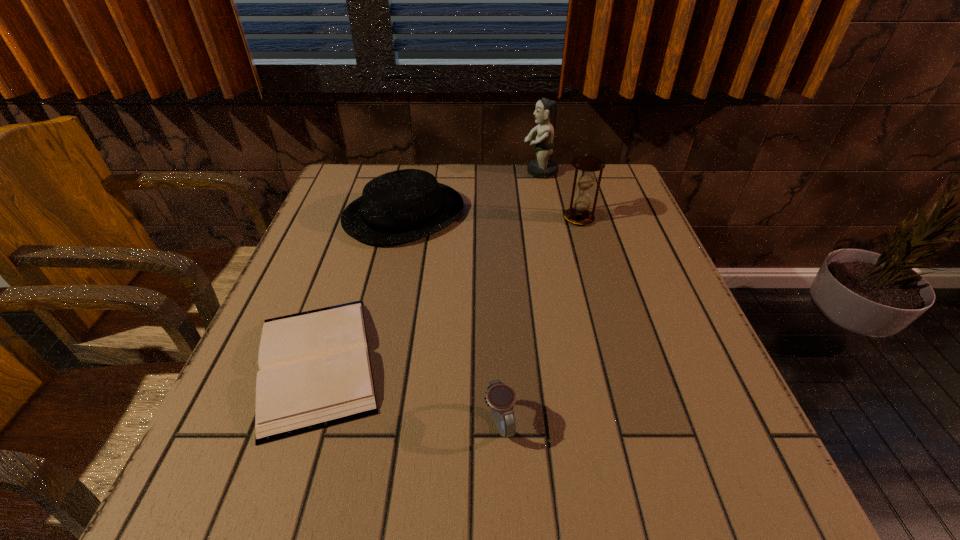
At what (x,y) coordinates should I click in order to perform the action: click on blank space located on the back of the second tallest object. Please return your answer as a coordinate pair (x, y). Looking at the image, I should click on (572, 195).

This screenshot has width=960, height=540. I want to click on free location located 0.340m on the right of the third shortest object, so click(595, 214).

You are a GUI agent. You are given a task and a screenshot of the screen. Output one action in this format:
    pyautogui.click(x=<x>, y=<y>)
    Task: Click on the free spot located on the back of the watch
    The image size is (960, 540).
    Given the screenshot: What is the action you would take?
    pyautogui.click(x=495, y=313)

Identify the location of free region located on the back of the hardback book. (357, 242).

Image resolution: width=960 pixels, height=540 pixels. Identify the location of figurine at the far edge. point(542,167).

Locate an element on the screen. fedora at the far edge is located at coordinates (405, 205).

Find the location of a particular element. This screenshot has height=540, width=960. fedora situated at the left edge is located at coordinates (405, 205).

The width and height of the screenshot is (960, 540). What are the coordinates of `hardback book that is at the left edge` in the screenshot? It's located at (315, 371).

I want to click on object that is at the right edge, so click(x=581, y=200).

This screenshot has height=540, width=960. I want to click on object that is at the far left corner, so (405, 205).